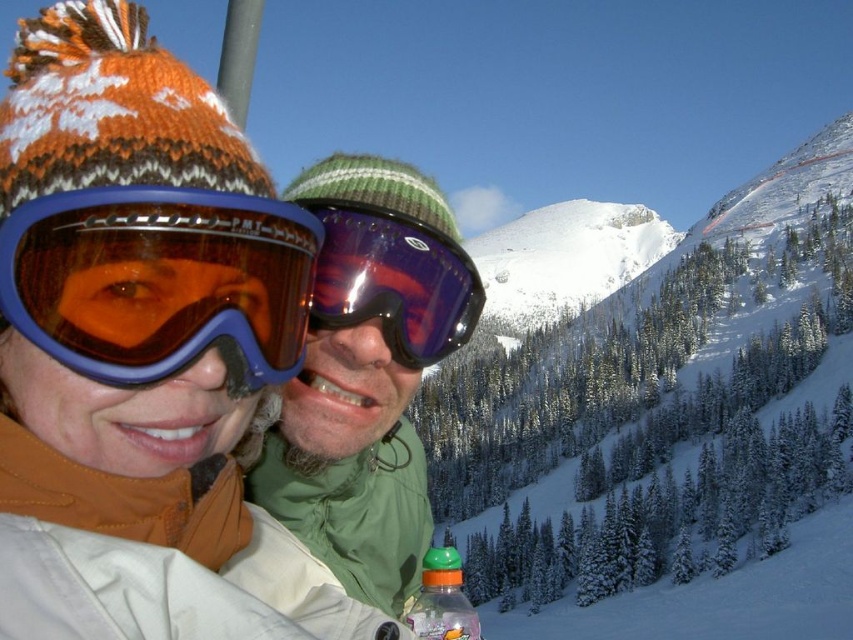
Question: Which is nearer to the translucent plastic bottle at lower center?

Choices:
 (A) green matte jacket at center
 (B) purple reflective goggles at center

Answer: (A)

Question: In this image, where is green matte jacket at center located relative to translucent plastic bottle at lower center?

Choices:
 (A) above
 (B) below

Answer: (A)

Question: Which point appears closest to the camera in this image?

Choices:
 (A) (354, 429)
 (B) (317, 317)
 (C) (440, 580)

Answer: (A)

Question: Estimate the real-world distances between objects in this image. Which object is farther from the matte orange knit hat at upper left?

Choices:
 (A) translucent plastic bottle at lower center
 (B) green matte jacket at center
 (C) orange tinted plastic goggles at left
 (D) purple reflective goggles at center

Answer: (A)

Question: Is the position of green matte jacket at center less distant than that of purple reflective goggles at center?

Choices:
 (A) no
 (B) yes

Answer: (B)

Question: Does matte orange knit hat at upper left appear on the right side of translucent plastic bottle at lower center?

Choices:
 (A) no
 (B) yes

Answer: (A)